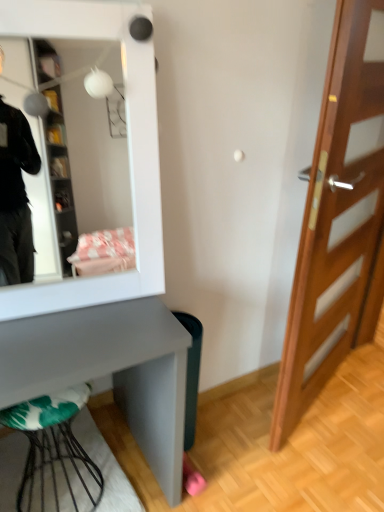
Image resolution: width=384 pixels, height=512 pixels. In order to click on free region under wooden door at right (from a real-world perspective) in this screenshot , I will do `click(320, 405)`.